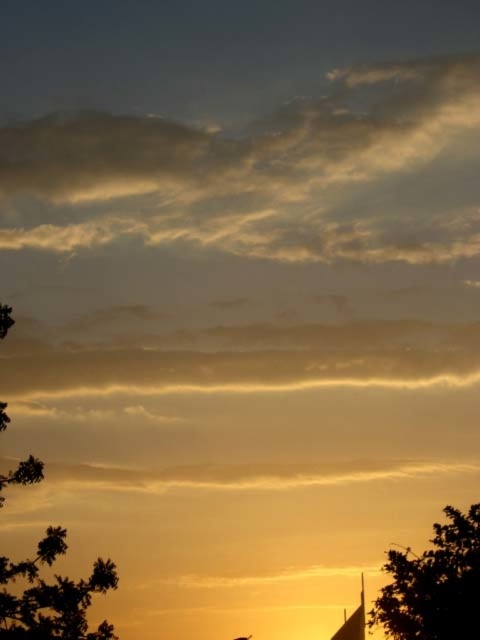
Question: Which object is closer to the camera taking this photo?

Choices:
 (A) green leafy tree at lower right
 (B) dark green leafy tree at left

Answer: (B)

Question: Does green leafy tree at lower right appear on the left side of dark green leafy tree at left?

Choices:
 (A) no
 (B) yes

Answer: (A)

Question: Is green leafy tree at lower right above dark green leafy tree at left?

Choices:
 (A) yes
 (B) no

Answer: (B)

Question: Does green leafy tree at lower right have a lesser width compared to dark green leafy tree at left?

Choices:
 (A) yes
 (B) no

Answer: (B)

Question: Which point is farther from the camera taking this photo?

Choices:
 (A) (2, 308)
 (B) (409, 621)

Answer: (B)